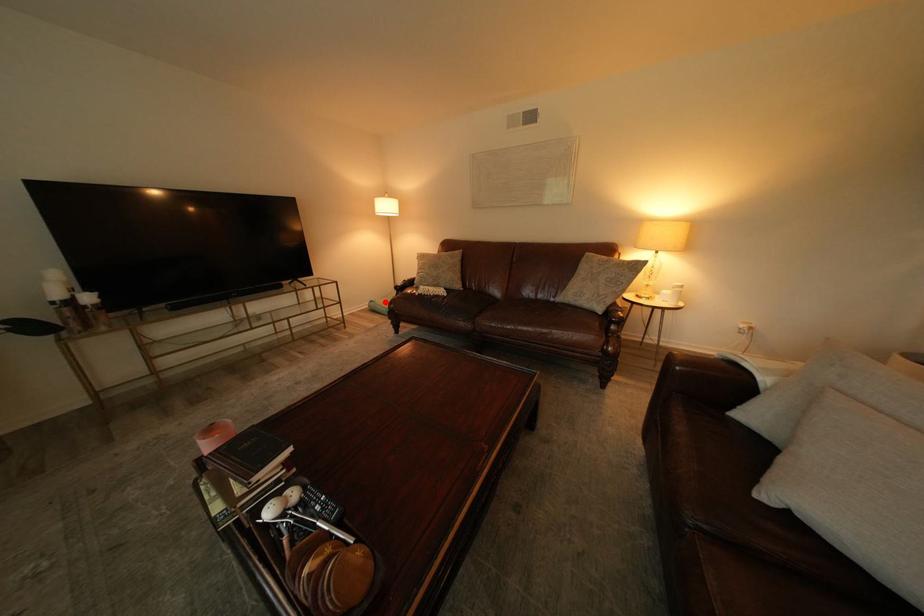
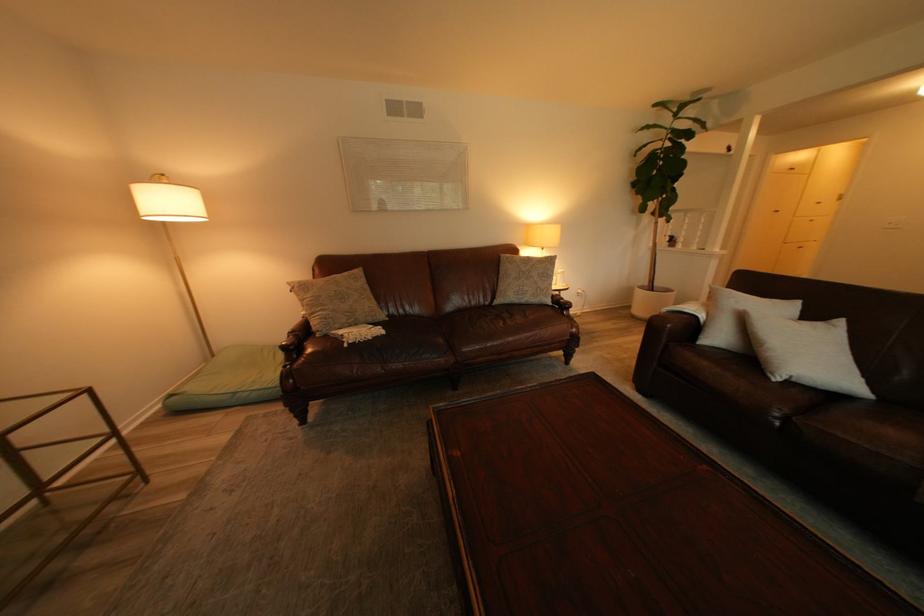
Locate, in the second image, the point that corresponds to the highlighted location in the first image.

(186, 395)